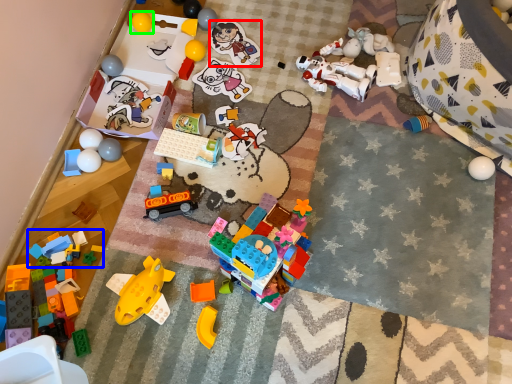
Question: Which object is the farthest from toy (highlighted by a red box)? Choose among these: toy (highlighted by a blue box) or toy (highlighted by a green box).

Choices:
 (A) toy
 (B) toy

Answer: (A)